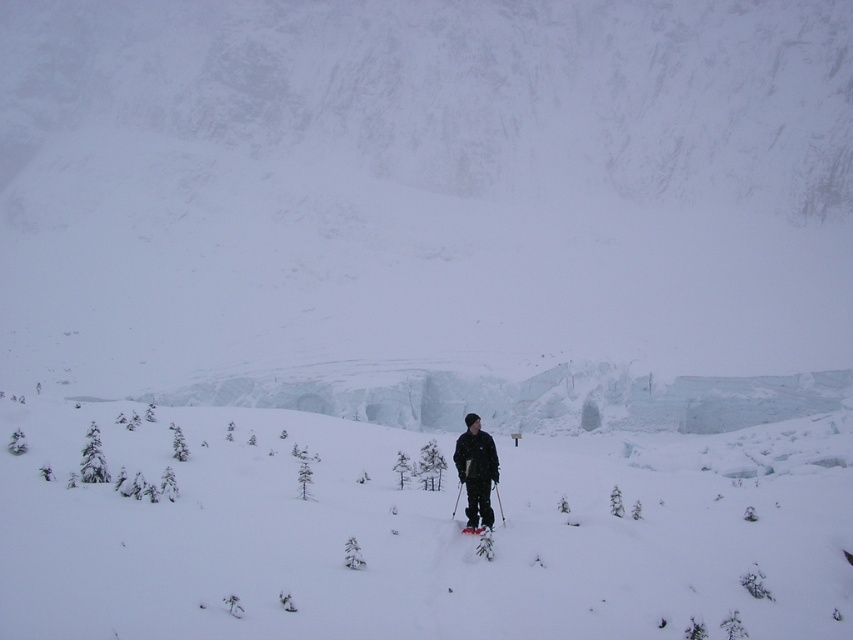
Is white fluffy snow at center taller than black matte jacket at center?

Indeed, white fluffy snow at center has a greater height compared to black matte jacket at center.

Does white fluffy snow at center have a greater width compared to black matte jacket at center?

Yes, white fluffy snow at center is wider than black matte jacket at center.

Is point (99, 634) more distant than point (462, 440)?

No.

The image size is (853, 640). In order to click on white fluffy snow at center in this screenshot , I will do `click(418, 531)`.

Can you confirm if white fluffy snow at center is wider than white matte ski at center?

Correct, the width of white fluffy snow at center exceeds that of white matte ski at center.

Describe the element at coordinates (418, 531) in the screenshot. I see `white fluffy snow at center` at that location.

Find the location of `white fluffy snow at center`. white fluffy snow at center is located at coordinates (418, 531).

Is white fluffy snow at center smaller than shiny red ski at center?

Incorrect, white fluffy snow at center is not smaller in size than shiny red ski at center.

Is white fluffy snow at center bigger than shiny red ski at center?

Yes, white fluffy snow at center is bigger than shiny red ski at center.

Identify the location of white fluffy snow at center. This screenshot has width=853, height=640. (418, 531).